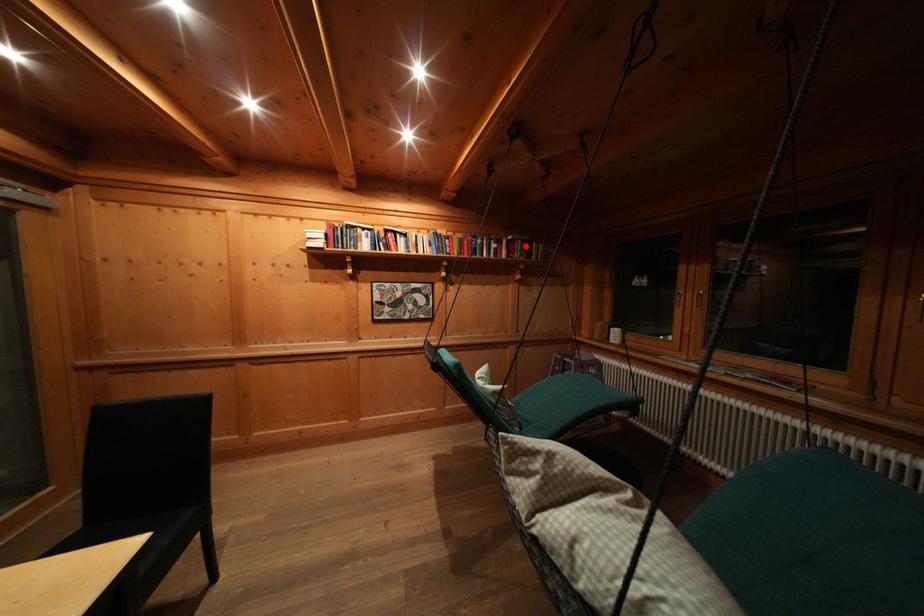
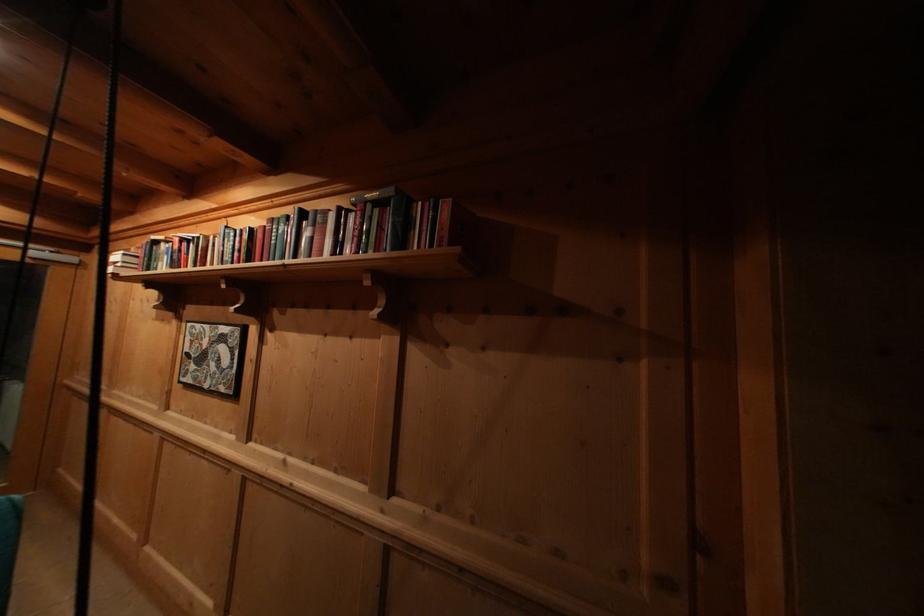
In the second image, find the point that corresponds to the highlighted location in the first image.

(375, 211)